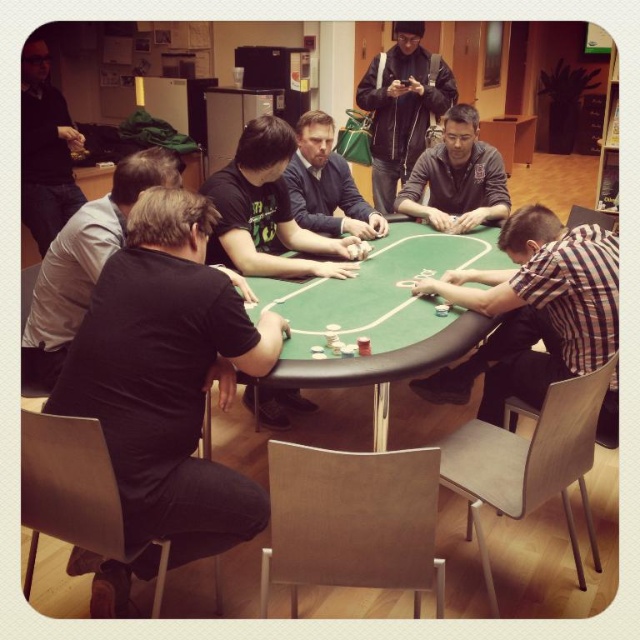
You are standing in the room and want to join the poker game. Where is the green felt poker table at center located?

The green felt poker table at center is located at point (381, 317).

You are standing at the center of the poker table and want to locate the plaid cotton shirt at lower right. In which direction should you look to find it?

The plaid cotton shirt at lower right is located at point [532,312], so you should look to your lower right direction to find it.

You are a new player entering the room and see the green felt poker table at center and the matte blue shirt at center. Which object is wider?

The green felt poker table at center is wider than the matte blue shirt at center.